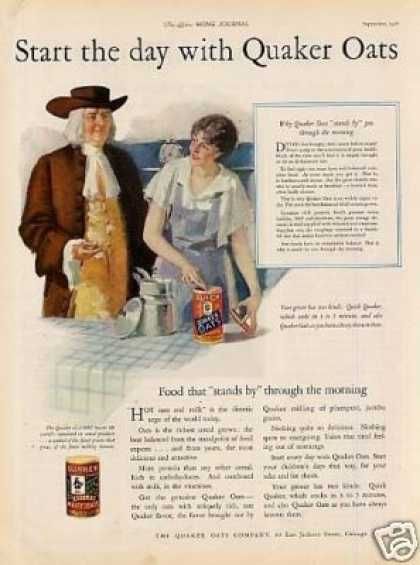
The width and height of the screenshot is (420, 565). Find the location of `jar`. jar is located at coordinates (148, 305).